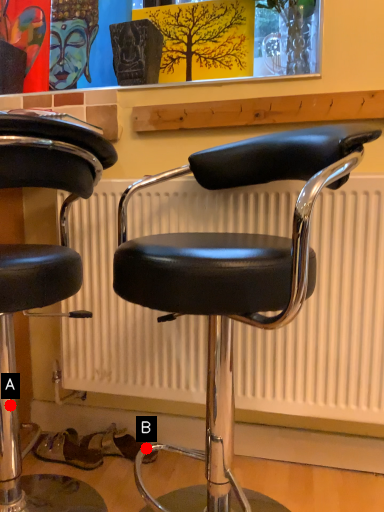
Question: Two points are circled on the image, labeled by A and B beside each circle. Which point appears farthest from the camera in this image?

Choices:
 (A) A is further
 (B) B is further

Answer: (B)